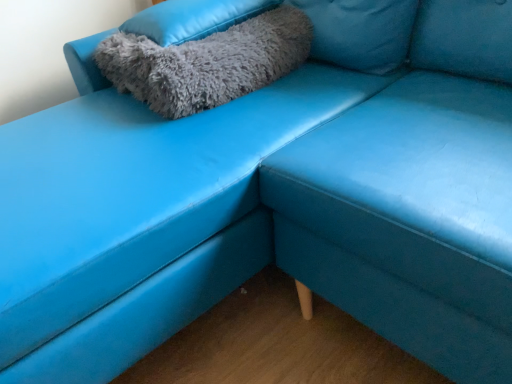
Question: Is gray fluffy pillow at upper left, which is the first pillow from bottom to top, wider or thinner than gray fluffy pillow at upper left, the 1th pillow viewed from the top?

Choices:
 (A) thin
 (B) wide

Answer: (A)

Question: From their relative heights in the image, would you say gray fluffy pillow at upper left, which is the first pillow from bottom to top, is taller or shorter than gray fluffy pillow at upper left, which ranks as the second pillow in bottom-to-top order?

Choices:
 (A) short
 (B) tall

Answer: (B)

Question: Based on their sizes in the image, would you say gray fluffy pillow at upper left, which ranks as the 2th pillow in top-to-bottom order, is bigger or smaller than gray fluffy pillow at upper left, the 1th pillow viewed from the top?

Choices:
 (A) small
 (B) big

Answer: (B)

Question: Considering the positions of gray fluffy pillow at upper left, the 1th pillow viewed from the top, and gray fluffy pillow at upper left, which is the first pillow from bottom to top, in the image, is gray fluffy pillow at upper left, the 1th pillow viewed from the top, wider or thinner than gray fluffy pillow at upper left, which is the first pillow from bottom to top,?

Choices:
 (A) thin
 (B) wide

Answer: (B)

Question: From a real-world perspective, relative to gray fluffy pillow at upper left, which is the first pillow from bottom to top, is gray fluffy pillow at upper left, which ranks as the second pillow in bottom-to-top order, vertically above or below?

Choices:
 (A) below
 (B) above

Answer: (B)

Question: Choose the correct answer: Is gray fluffy pillow at upper left, which ranks as the second pillow in bottom-to-top order, inside gray fluffy pillow at upper left, which ranks as the 2th pillow in top-to-bottom order, or outside it?

Choices:
 (A) inside
 (B) outside

Answer: (B)

Question: Relative to gray fluffy pillow at upper left, which is the first pillow from bottom to top, is gray fluffy pillow at upper left, the 1th pillow viewed from the top, in front or behind?

Choices:
 (A) behind
 (B) front

Answer: (A)